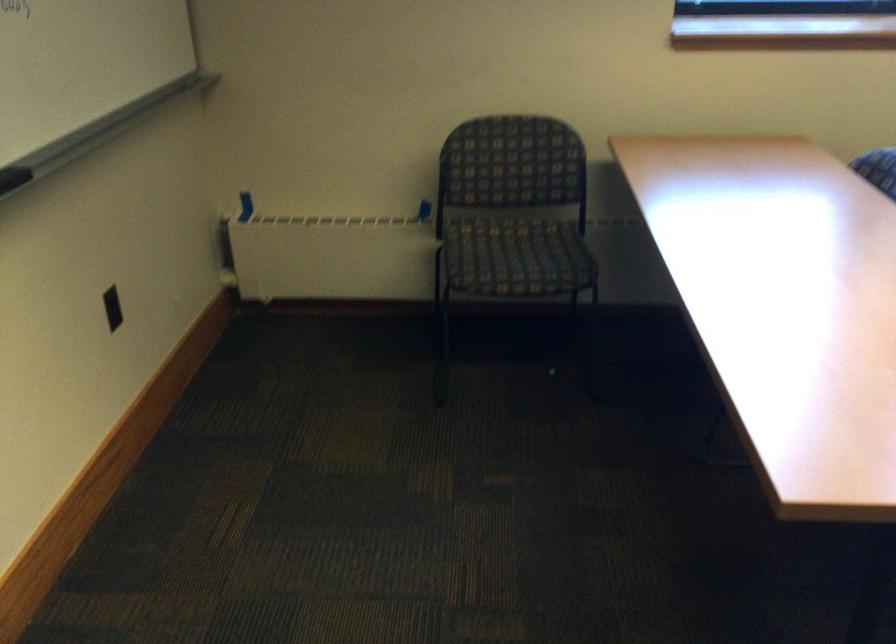
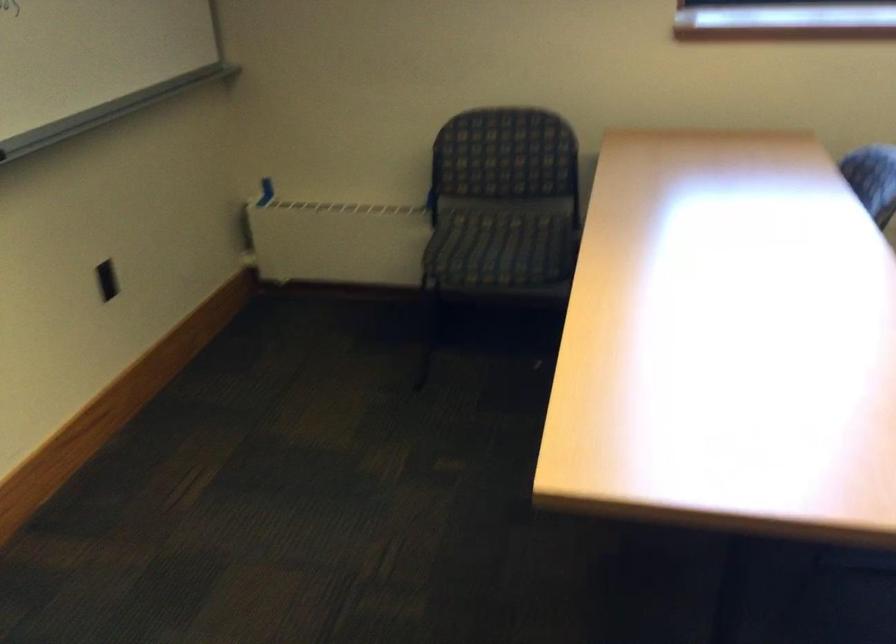
Question: Based on the continuous images, in which direction is the camera rotating? Reply with the corresponding letter.

Choices:
 (A) Left
 (B) Right
 (C) Up
 (D) Down

Answer: (A)